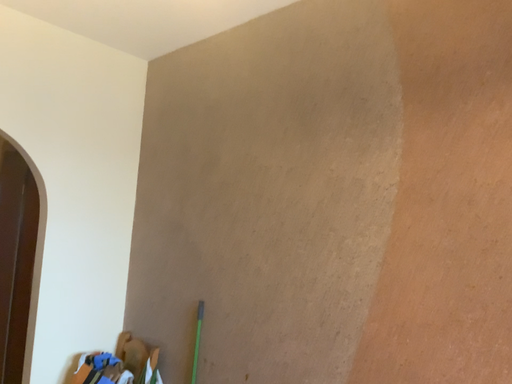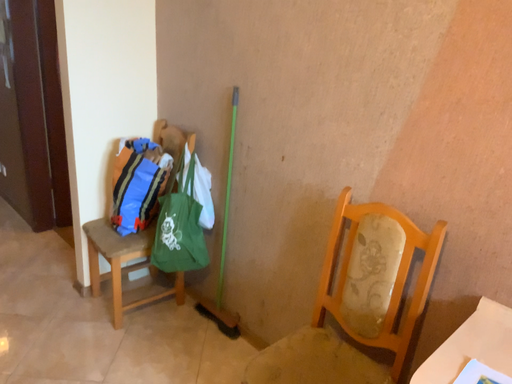
Question: How did the camera likely rotate when shooting the video?

Choices:
 (A) rotated upward
 (B) rotated downward

Answer: (B)